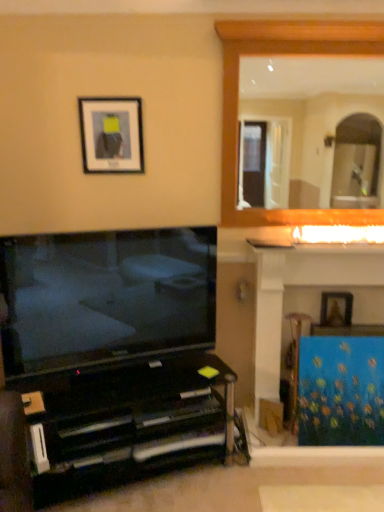
The width and height of the screenshot is (384, 512). Identify the location of blue canvas painting at right. (302, 285).

Measure the distance between point (320, 320) and camera.

The distance of point (320, 320) from camera is 2.45 meters.

Find the location of a particular element. matte black tv at lower left is located at coordinates (105, 297).

At what (x,y) coordinates should I click in order to perform the action: click on matte black picture frame at upper left, placed as the first picture frame when sorted from left to right. Please return your answer as a coordinate pair (x, y). The image size is (384, 512). Looking at the image, I should click on (111, 135).

Where is `blue canvas painting at right`? The height and width of the screenshot is (512, 384). blue canvas painting at right is located at coordinates (302, 285).

How different are the orientations of matte black picture frame at upper left, placed as the first picture frame when sorted from left to right, and blue canvas painting at right in degrees?

0.0126 degrees separate the facing orientations of matte black picture frame at upper left, placed as the first picture frame when sorted from left to right, and blue canvas painting at right.

Are matte black picture frame at upper left, the 2th picture frame positioned from the back, and blue canvas painting at right beside each other?

No, matte black picture frame at upper left, the 2th picture frame positioned from the back, is not beside blue canvas painting at right.

In the image, is matte black picture frame at upper left, the 2th picture frame positioned from the back, on the left side or the right side of blue canvas painting at right?

Clearly, matte black picture frame at upper left, the 2th picture frame positioned from the back, is on the left of blue canvas painting at right in the image.

Which of these two, matte black picture frame at upper left, positioned as the first picture frame in front-to-back order, or blue canvas painting at right, is wider?

blue canvas painting at right is wider.

Is black glossy entertainment center at lower left oriented away from wooden picture frame at upper right, the 1th picture frame in the right-to-left sequence?

That's not correct — black glossy entertainment center at lower left is not looking away from wooden picture frame at upper right, the 1th picture frame in the right-to-left sequence.

Is black glossy entertainment center at lower left positioned behind wooden picture frame at upper right, the second picture frame positioned from the front?

No, black glossy entertainment center at lower left is in front of wooden picture frame at upper right, the second picture frame positioned from the front.

Considering the positions of points (76, 387) and (336, 298), is point (76, 387) closer to camera compared to point (336, 298)?

Yes.

Is wooden picture frame at upper right, which ranks as the first picture frame in bottom-to-top order, inside black glossy entertainment center at lower left?

Actually, wooden picture frame at upper right, which ranks as the first picture frame in bottom-to-top order, is outside black glossy entertainment center at lower left.

Considering the sizes of objects black glossy entertainment center at lower left and matte black picture frame at upper left, the 2th picture frame positioned from the back, in the image provided, who is bigger, black glossy entertainment center at lower left or matte black picture frame at upper left, the 2th picture frame positioned from the back,?

With larger size is black glossy entertainment center at lower left.

Which is behind, point (160, 359) or point (130, 170)?

Positioned behind is point (130, 170).

Looking at this image, from a real-world perspective, who is located lower, black glossy entertainment center at lower left or matte black picture frame at upper left, which is counted as the second picture frame, starting from the bottom?

black glossy entertainment center at lower left, from a real-world perspective.

Is wooden picture frame at upper right, which is the 2th picture frame from left to right, oriented towards matte black picture frame at upper left, the second picture frame when ordered from right to left?

No, wooden picture frame at upper right, which is the 2th picture frame from left to right, is not facing towards matte black picture frame at upper left, the second picture frame when ordered from right to left.

Which of these two, wooden picture frame at upper right, which ranks as the first picture frame in bottom-to-top order, or matte black picture frame at upper left, the 1th picture frame positioned from the top, is bigger?

matte black picture frame at upper left, the 1th picture frame positioned from the top, is bigger.

From the image's perspective, is wooden picture frame at upper right, placed as the first picture frame when sorted from back to front, located beneath matte black picture frame at upper left, placed as the first picture frame when sorted from left to right?

Correct, wooden picture frame at upper right, placed as the first picture frame when sorted from back to front, appears lower than matte black picture frame at upper left, placed as the first picture frame when sorted from left to right, in the image.

Considering the relative positions of wooden picture frame at upper right, which appears as the second picture frame when viewed from the top, and matte black picture frame at upper left, which is counted as the second picture frame, starting from the bottom, in the image provided, is wooden picture frame at upper right, which appears as the second picture frame when viewed from the top, to the left or to the right of matte black picture frame at upper left, which is counted as the second picture frame, starting from the bottom,?

wooden picture frame at upper right, which appears as the second picture frame when viewed from the top, is to the right of matte black picture frame at upper left, which is counted as the second picture frame, starting from the bottom.

Between point (62, 463) and point (29, 337), which one is positioned in front?

The point (29, 337) is closer.

Can matte black tv at lower left be found inside black glossy entertainment center at lower left?

No, matte black tv at lower left is located outside of black glossy entertainment center at lower left.

Considering the relative positions of black glossy entertainment center at lower left and matte black tv at lower left in the image provided, is black glossy entertainment center at lower left to the left of matte black tv at lower left from the viewer's perspective?

No.

How distant is blue canvas painting at right from black glossy entertainment center at lower left?

The distance of blue canvas painting at right from black glossy entertainment center at lower left is 28.11 inches.

Is blue canvas painting at right wider or thinner than black glossy entertainment center at lower left?

blue canvas painting at right is wider than black glossy entertainment center at lower left.

From the image's perspective, which one is positioned lower, blue canvas painting at right or black glossy entertainment center at lower left?

black glossy entertainment center at lower left appears lower in the image.

Is blue canvas painting at right situated inside black glossy entertainment center at lower left or outside?

blue canvas painting at right is not inside black glossy entertainment center at lower left, it's outside.

Consider the image. Considering the relative sizes of black glossy entertainment center at lower left and blue canvas painting at right in the image provided, is black glossy entertainment center at lower left wider than blue canvas painting at right?

No.

Consider the image. From a real-world perspective, between black glossy entertainment center at lower left and blue canvas painting at right, who is vertically higher?

From a 3D spatial view, blue canvas painting at right is above.

At what (x,y) coordinates should I click in order to perform the action: click on furniture in front of the blue canvas painting at right. Please return your answer as a coordinate pair (x, y). The height and width of the screenshot is (512, 384). Looking at the image, I should click on (126, 422).

Is black glossy entertainment center at lower left bigger than blue canvas painting at right?

No, black glossy entertainment center at lower left is not bigger than blue canvas painting at right.

You are a GUI agent. You are given a task and a screenshot of the screen. Output one action in this format:
    pyautogui.click(x=<x>, y=<y>)
    Task: Click on the dresser that is in front of the matte black picture frame at upper left, placed as the first picture frame when sorted from left to right
    
    Given the screenshot: What is the action you would take?
    pyautogui.click(x=302, y=285)

Locate an element on the screen. This screenshot has height=512, width=384. furniture below the wooden picture frame at upper right, which is the 2th picture frame from left to right (from the image's perspective) is located at coordinates click(126, 422).

Based on their spatial positions, is blue fabric at right or wooden frame at upper right closer to matte black tv at lower left?

blue fabric at right lies closer to matte black tv at lower left than the other object.

Considering their positions, is blue fabric at right positioned closer to wooden picture frame at upper right, the 1th picture frame in the right-to-left sequence, than wooden frame at upper right?

blue fabric at right is closer to wooden picture frame at upper right, the 1th picture frame in the right-to-left sequence.

Estimate the real-world distances between objects in this image. Which object is further from blue fabric at right, wooden frame at upper right or black glossy entertainment center at lower left?

The object further to blue fabric at right is wooden frame at upper right.

Considering their positions, is blue fabric at right positioned closer to wooden picture frame at upper right, which is the 2th picture frame from left to right, than matte black tv at lower left?

Based on the image, blue fabric at right appears to be nearer to wooden picture frame at upper right, which is the 2th picture frame from left to right.

Estimate the real-world distances between objects in this image. Which object is further from wooden picture frame at upper right, which appears as the second picture frame when viewed from the top, matte black tv at lower left or blue canvas painting at right?

matte black tv at lower left is further to wooden picture frame at upper right, which appears as the second picture frame when viewed from the top.

Based on their spatial positions, is matte black picture frame at upper left, placed as the first picture frame when sorted from left to right, or blue fabric at right further from wooden picture frame at upper right, placed as the first picture frame when sorted from back to front?

matte black picture frame at upper left, placed as the first picture frame when sorted from left to right, is positioned further to the anchor wooden picture frame at upper right, placed as the first picture frame when sorted from back to front.

Looking at the image, which one is located closer to matte black picture frame at upper left, the 1th picture frame positioned from the top, wooden picture frame at upper right, which ranks as the first picture frame in bottom-to-top order, or blue canvas painting at right?

blue canvas painting at right is positioned closer to the anchor matte black picture frame at upper left, the 1th picture frame positioned from the top.

Which object lies further to the anchor point matte black tv at lower left, matte black picture frame at upper left, the second picture frame when ordered from right to left, or black glossy entertainment center at lower left?

The object further to matte black tv at lower left is matte black picture frame at upper left, the second picture frame when ordered from right to left.

Where is `furniture between matte black tv at lower left and blue fabric at right`? The height and width of the screenshot is (512, 384). furniture between matte black tv at lower left and blue fabric at right is located at coordinates (126, 422).

Locate an element on the screen. The image size is (384, 512). television between wooden frame at upper right and blue canvas painting at right in the vertical direction is located at coordinates (105, 297).

The width and height of the screenshot is (384, 512). Identify the location of curtain between matte black picture frame at upper left, positioned as the first picture frame in front-to-back order, and wooden picture frame at upper right, which is the 2th picture frame from left to right, in the horizontal direction. (341, 391).

Find the location of a particular element. The width and height of the screenshot is (384, 512). dresser between wooden frame at upper right and black glossy entertainment center at lower left in the up-down direction is located at coordinates (302, 285).